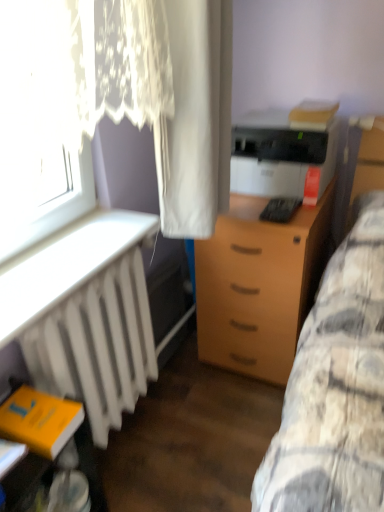
Locate an element on the screen. This screenshot has width=384, height=512. free space below white fabric curtain at center, the 2th curtain in the left-to-right sequence (from a real-world perspective) is located at coordinates (213, 399).